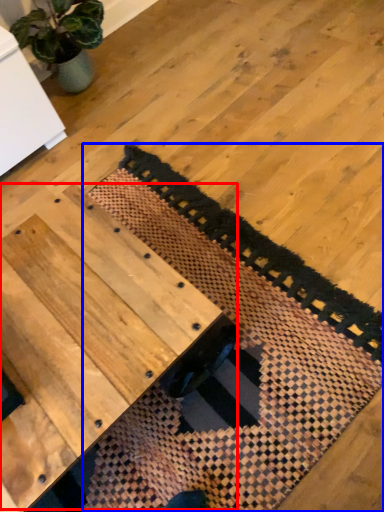
Question: Which point is closer to the camera, table (highlighted by a red box) or mat (highlighted by a blue box)?

Choices:
 (A) table
 (B) mat

Answer: (A)